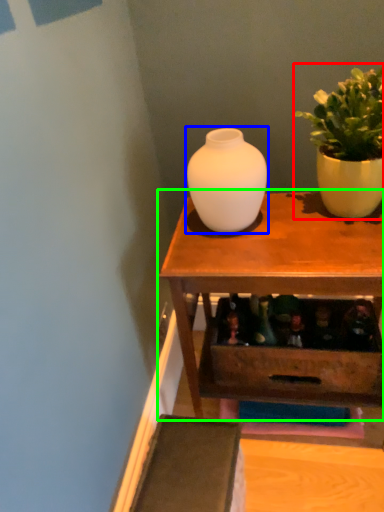
Question: Which object is positioned farthest from houseplant (highlighted by a red box)? Select from vase (highlighted by a blue box) and table (highlighted by a green box).

Choices:
 (A) vase
 (B) table

Answer: (B)